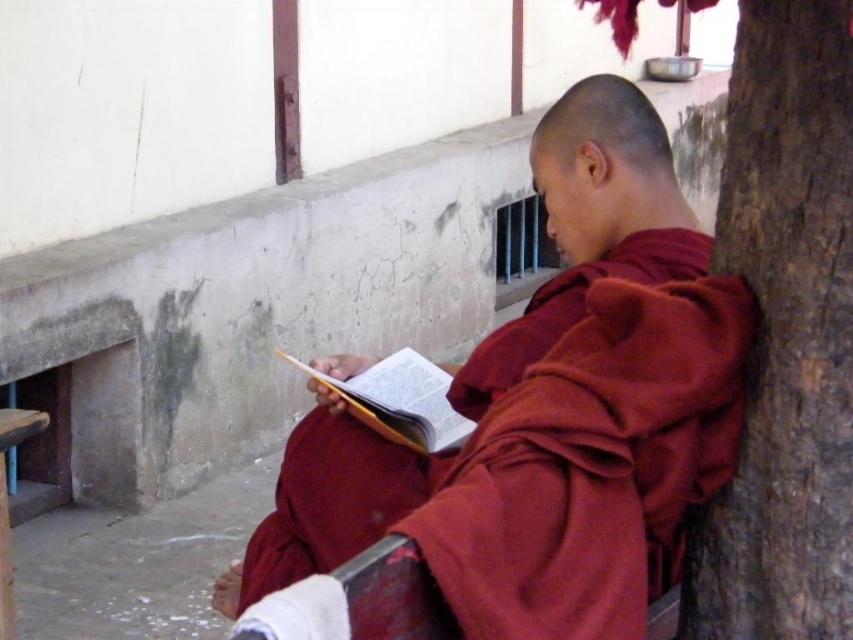
Does maroon cloth at center have a lesser width compared to yellow paper book at center?

No.

Can you confirm if maroon cloth at center is bigger than yellow paper book at center?

Indeed, maroon cloth at center has a larger size compared to yellow paper book at center.

In order to click on maroon cloth at center in this screenshot , I will do (x=590, y=227).

Does brown rough bark at right appear under maroon cloth at center?

No, brown rough bark at right is not below maroon cloth at center.

Does brown rough bark at right have a smaller size compared to maroon cloth at center?

Yes, brown rough bark at right is smaller than maroon cloth at center.

This screenshot has width=853, height=640. I want to click on brown rough bark at right, so click(x=785, y=336).

The height and width of the screenshot is (640, 853). I want to click on brown rough bark at right, so click(785, 336).

Does point (782, 435) lie behind point (354, 410)?

No, it is not.

Can you confirm if brown rough bark at right is thinner than yellow paper book at center?

Correct, brown rough bark at right's width is less than yellow paper book at center's.

Which is behind, point (820, 145) or point (380, 376)?

The point (380, 376) is more distant.

Locate an element on the screen. The image size is (853, 640). brown rough bark at right is located at coordinates (785, 336).